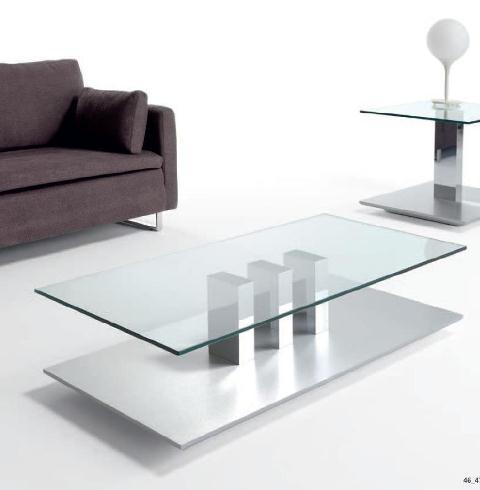
Find the location of a particular element. The height and width of the screenshot is (490, 480). end table is located at coordinates point(448,116).